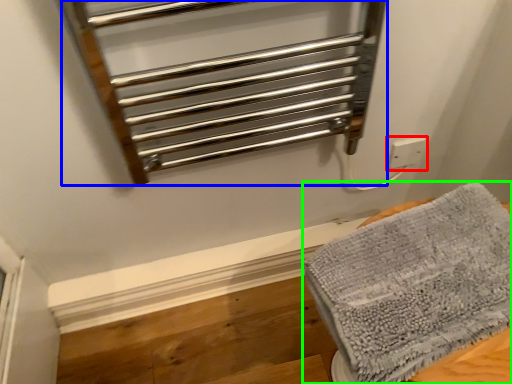
Question: Based on their relative distances, which object is nearer to electric outlet (highlighted by a red box)? Choose from cage (highlighted by a blue box) and towel (highlighted by a green box).

Choices:
 (A) cage
 (B) towel

Answer: (A)